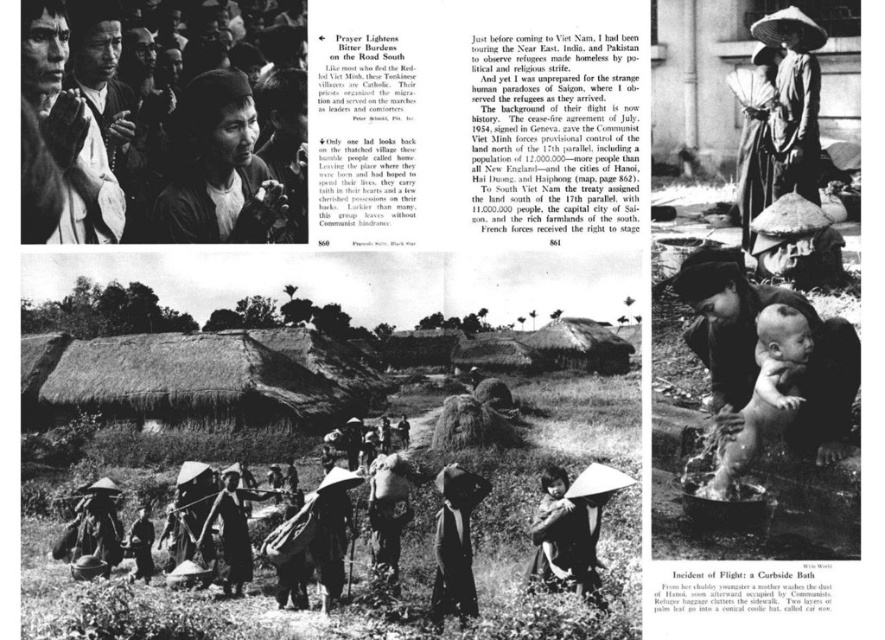
Based on the photo, you are standing at the bottom of the image and looking upward. Which of the two points, point (758, 346) or point (560, 556), is closer to your viewpoint?

Point (758, 346) is closer to your viewpoint because it is in front of point (560, 556).

In the central section of the historical photograph, you notice a dark skin baby at lower right and a matte white hat at center. Which object is smaller in size?

The dark skin baby at lower right is smaller in size compared to the matte white hat at center.